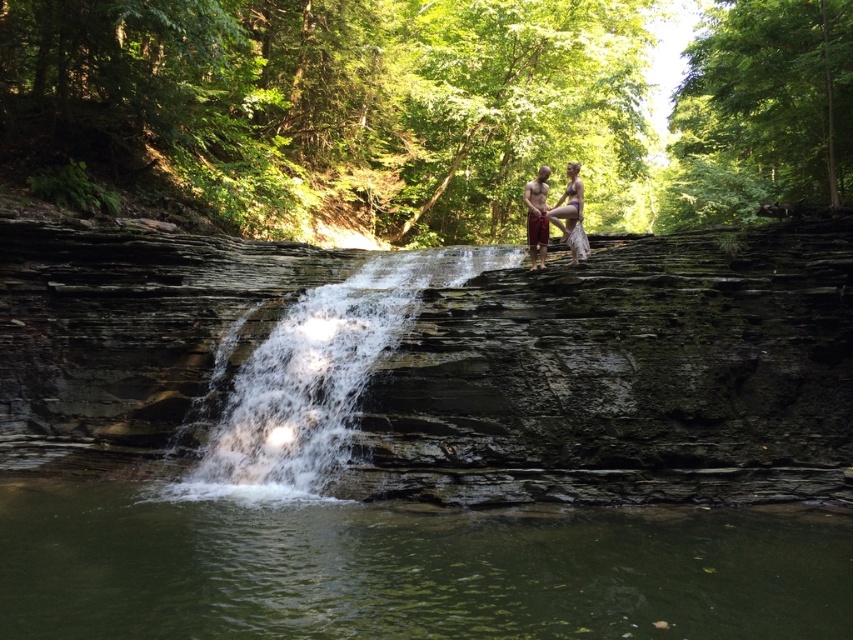
Who is positioned more to the left, greenish water at lower center or matte white dress at center?

Positioned to the left is greenish water at lower center.

Is greenish water at lower center thinner than matte white dress at center?

No, greenish water at lower center is not thinner than matte white dress at center.

Which is behind, point (556, 609) or point (543, 227)?

The point (543, 227) is behind.

Image resolution: width=853 pixels, height=640 pixels. Identify the location of greenish water at lower center. (407, 570).

Does greenish water at lower center lie behind matte skin couple at center?

No, it is not.

Who is more distant from viewer, (202,529) or (564,196)?

Positioned behind is point (564,196).

Between point (831, 604) and point (540, 264), which one is positioned in front?

Point (831, 604) is in front.

I want to click on greenish water at lower center, so click(x=407, y=570).

Does matte skin couple at center appear over matte white dress at center?

Yes, matte skin couple at center is above matte white dress at center.

Is matte skin couple at center below matte white dress at center?

Incorrect, matte skin couple at center is not positioned below matte white dress at center.

The width and height of the screenshot is (853, 640). What are the coordinates of `matte skin couple at center` in the screenshot? It's located at (555, 212).